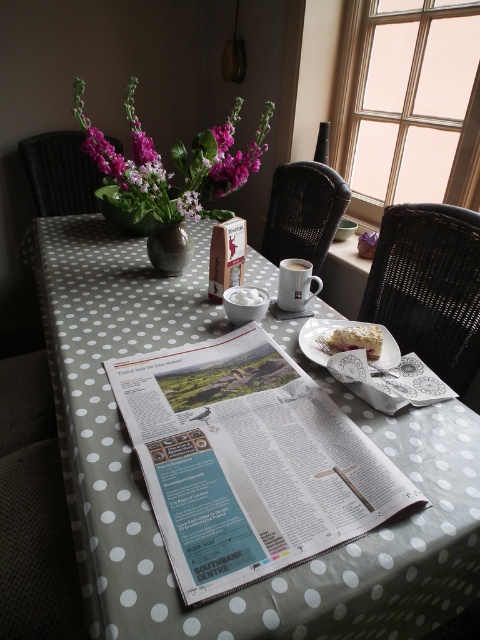
You are standing in front of the table with the polka dot tablecloth. There is a point marked at coordinates [285,180] on the table. If you want to place a 2 meter long ruler from your current position to that point, will it reach?

The point at coordinates [285,180] is 1.93 meters away from the camera. Since the ruler is 2 meters long, it will just barely reach the point, as the distance is slightly less than the ruler length.

You are organizing a small tea party and need to place a 12x12 inch cake plate on the table. Given the white printed newspaper at center and the black woven chair at right, which object can you move to make space?

The white printed newspaper at center is bigger than the black woven chair at right, so you should move the black woven chair at right to create more space for the cake plate.

You are a guest at this breakfast table and want to choose between the crumbly white cake at lower right and the white ceramic saucer at center. Which item is larger?

The crumbly white cake at lower right is bigger than the white ceramic saucer at center.